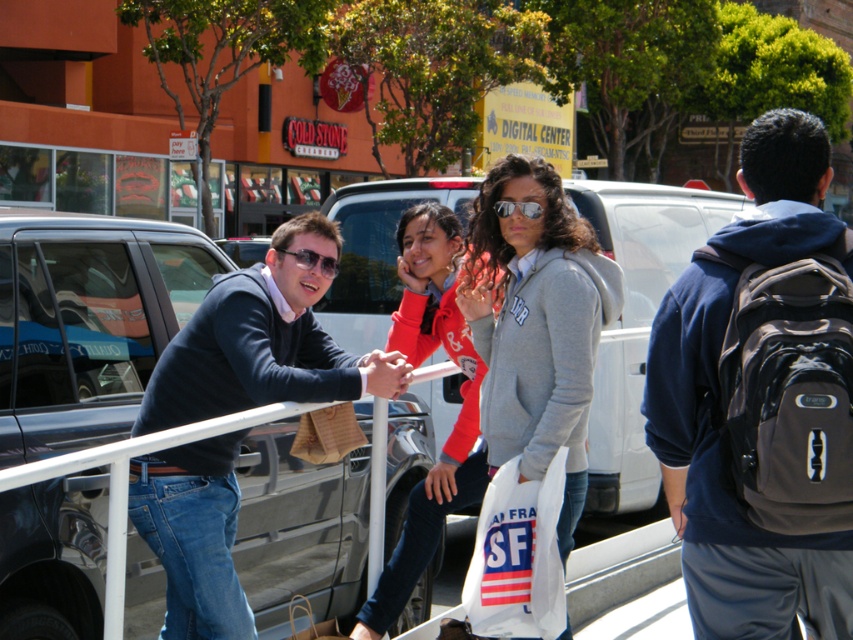
Between dark blue sweater at center and white plastic bag at center, which one has more height?

Standing taller between the two is dark blue sweater at center.

Who is more forward, (x=212, y=404) or (x=514, y=513)?

Positioned in front is point (x=514, y=513).

Locate an element on the screen. dark blue sweater at center is located at coordinates (265, 339).

Find the location of a particular element. dark blue sweater at center is located at coordinates (265, 339).

Is gray fleece hoodie at center positioned at the back of matte red hoodie at center?

That is False.

Does gray fleece hoodie at center have a smaller size compared to matte red hoodie at center?

Actually, gray fleece hoodie at center might be larger than matte red hoodie at center.

This screenshot has width=853, height=640. I want to click on gray fleece hoodie at center, so click(x=537, y=323).

Is gray fleece hoodie at center smaller than white plastic bag at center?

No, gray fleece hoodie at center is not smaller than white plastic bag at center.

Can you confirm if gray fleece hoodie at center is taller than white plastic bag at center?

Indeed, gray fleece hoodie at center has a greater height compared to white plastic bag at center.

What do you see at coordinates (537, 323) in the screenshot? I see `gray fleece hoodie at center` at bounding box center [537, 323].

At what (x,y) coordinates should I click in order to perform the action: click on gray fleece hoodie at center. Please return your answer as a coordinate pair (x, y). Image resolution: width=853 pixels, height=640 pixels. Looking at the image, I should click on (537, 323).